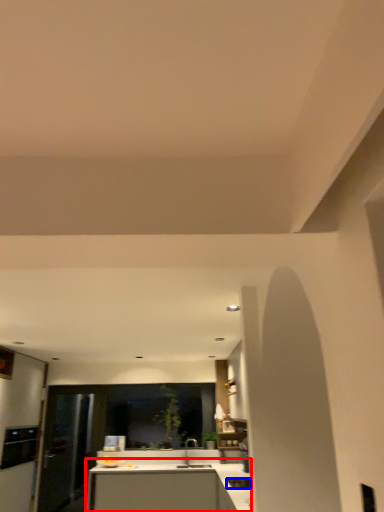
Question: Which of the following is the closest to the observer, countertop (highlighted by a red box) or appliance (highlighted by a blue box)?

Choices:
 (A) countertop
 (B) appliance

Answer: (B)